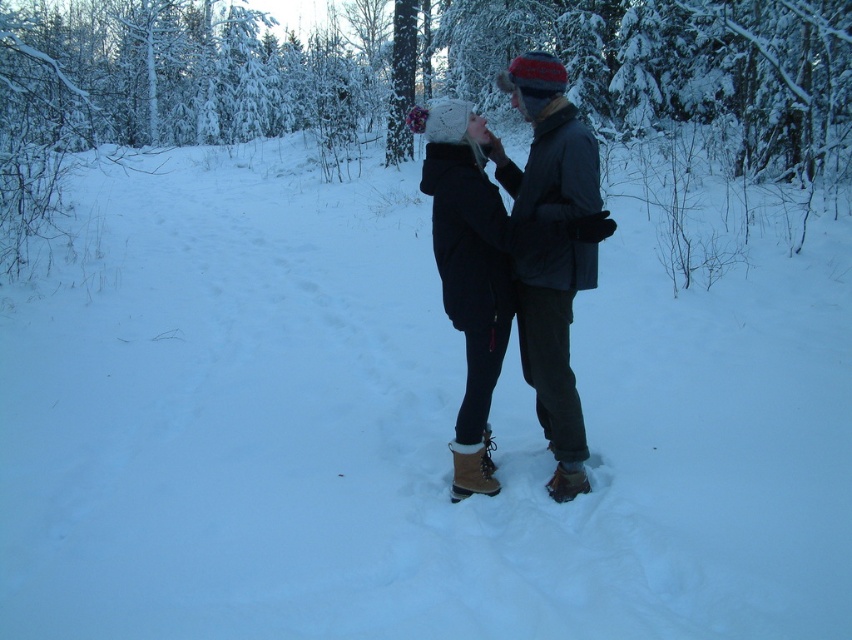
Question: Is knitted woolen hat at center to the left of brown suede snowshoe at lower center from the viewer's perspective?

Choices:
 (A) no
 (B) yes

Answer: (B)

Question: Is dark gray woolen jacket at center above brown suede snowshoe at center?

Choices:
 (A) no
 (B) yes

Answer: (B)

Question: Considering the real-world distances, which object is closest to the brown suede snowshoe at lower center?

Choices:
 (A) knitted woolen hat at center
 (B) dark gray woolen jacket at center

Answer: (A)

Question: Estimate the real-world distances between objects in this image. Which object is closer to the dark gray woolen jacket at center?

Choices:
 (A) brown suede snowshoe at center
 (B) brown suede snowshoe at lower center
 (C) knitted woolen hat at center

Answer: (C)

Question: Which point is farther from the camera taking this photo?

Choices:
 (A) (481, 340)
 (B) (464, 474)
 (C) (551, 208)
 (D) (580, 474)

Answer: (B)

Question: Does knitted woolen hat at center have a smaller size compared to brown suede snowshoe at lower center?

Choices:
 (A) yes
 (B) no

Answer: (B)